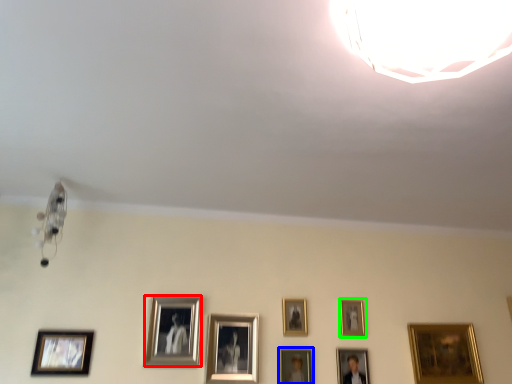
Question: Based on their relative distances, which object is farther from picture frame (highlighted by a red box)? Choose from picture frame (highlighted by a blue box) and picture frame (highlighted by a green box).

Choices:
 (A) picture frame
 (B) picture frame

Answer: (B)